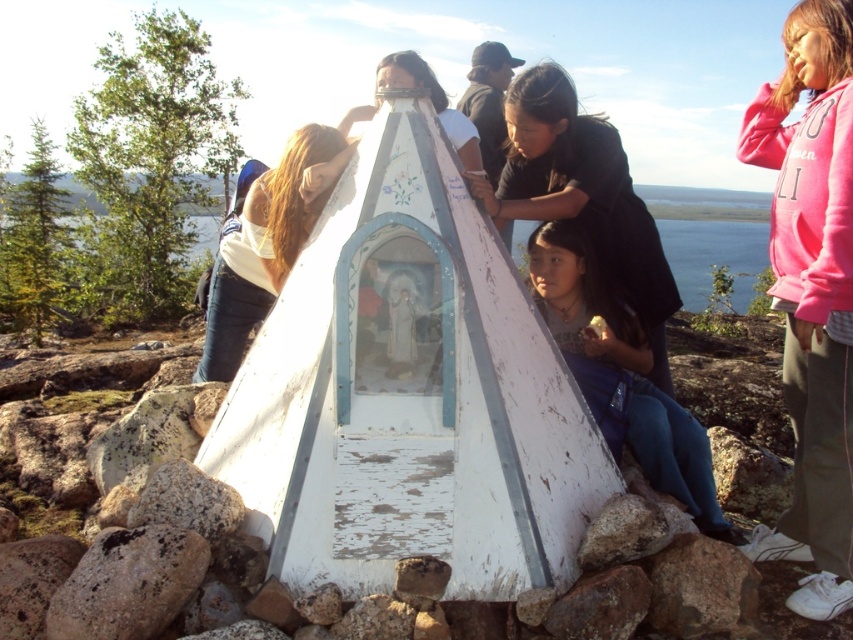
You are standing at the center of the shrine and want to place a small offering. You have two items with you, the matte white shirt at left and the speckled granite rock at lower left. If you want to place them on the altar such that the taller item is closer to the arched opening, which item should you place where?

The matte white shirt at left is taller than the speckled granite rock at lower left. Therefore, to place the taller item closer to the arched opening, you should position the matte white shirt at left near the front of the altar and the speckled granite rock at lower left further back.

You are a photographer standing at the edge of the water in the image. You notice the matte white shirt at left and the speckled granite rock at lower left. Which object is positioned higher from the ground?

The matte white shirt at left is above the speckled granite rock at lower left, so the matte white shirt at left is positioned higher from the ground.

You are an artist planning to sketch the scene. You notice the matte white statue at center and the matte white shirt at left. Which object should you draw first if you want to capture the wider object in your sketch?

The matte white shirt at left should be drawn first because it is wider than the matte white statue at center.